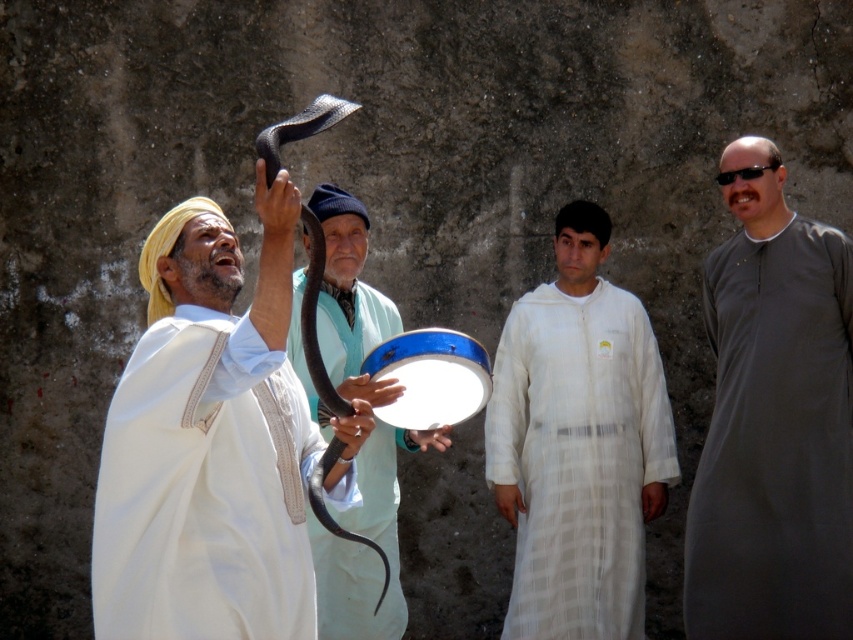
You are a photographer standing in front of the scene. You want to take a photo focusing on the smooth white robe at left and the gray matte robe at center. Which robe will appear larger in your photo?

The smooth white robe at left will appear larger in the photo because it is closer to the viewer than the gray matte robe at center.

You are a photographer trying to capture the central figure in the scene. The smooth white robe at left and the white textured robe at center are both visible in your frame. Which robe should you focus on to ensure the central figure is clearly visible?

The smooth white robe at left is positioned over the white textured robe at center, so focusing on the white textured robe at center would allow the central figure to be more clearly visible as it is not obscured by the other robe.